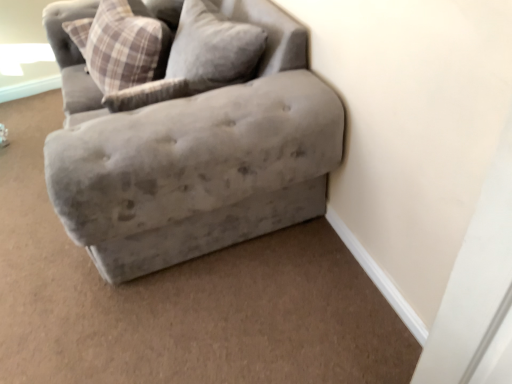
Question: Can you confirm if velvet gray couch at upper right is shorter than plaid fabric pillow at upper left?

Choices:
 (A) yes
 (B) no

Answer: (B)

Question: Could you tell me if velvet gray couch at upper right is turned towards plaid fabric pillow at upper left?

Choices:
 (A) yes
 (B) no

Answer: (A)

Question: Considering the relative sizes of velvet gray couch at upper right and plaid fabric pillow at upper left in the image provided, is velvet gray couch at upper right smaller than plaid fabric pillow at upper left?

Choices:
 (A) yes
 (B) no

Answer: (B)

Question: From the image's perspective, is velvet gray couch at upper right under plaid fabric pillow at upper left?

Choices:
 (A) no
 (B) yes

Answer: (B)

Question: Is velvet gray couch at upper right surrounding plaid fabric pillow at upper left?

Choices:
 (A) yes
 (B) no

Answer: (A)

Question: Does velvet gray couch at upper right touch plaid fabric pillow at upper left?

Choices:
 (A) no
 (B) yes

Answer: (A)

Question: Is plaid fabric pillow at upper left wider than velvet gray couch at upper right?

Choices:
 (A) yes
 (B) no

Answer: (B)

Question: Is plaid fabric pillow at upper left aimed at velvet gray couch at upper right?

Choices:
 (A) no
 (B) yes

Answer: (B)

Question: Can you confirm if plaid fabric pillow at upper left is smaller than velvet gray couch at upper right?

Choices:
 (A) no
 (B) yes

Answer: (B)

Question: From a real-world perspective, is plaid fabric pillow at upper left over velvet gray couch at upper right?

Choices:
 (A) no
 (B) yes

Answer: (B)

Question: Is plaid fabric pillow at upper left further to camera compared to velvet gray couch at upper right?

Choices:
 (A) no
 (B) yes

Answer: (B)

Question: Can you confirm if plaid fabric pillow at upper left is positioned to the left of velvet gray couch at upper right?

Choices:
 (A) yes
 (B) no

Answer: (A)

Question: Is velvet gray couch at upper right bigger or smaller than plaid fabric pillow at upper left?

Choices:
 (A) big
 (B) small

Answer: (A)